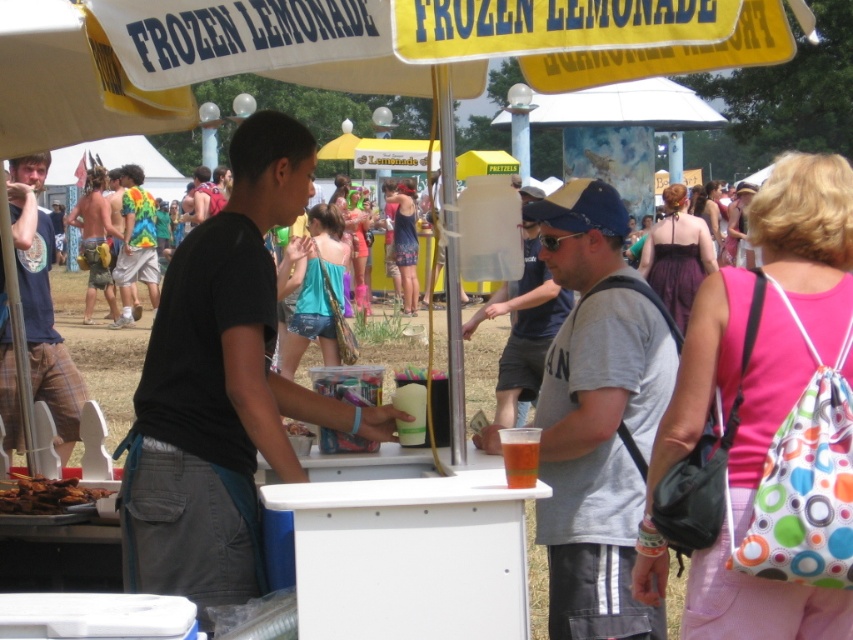
Is black fabric apron at center bigger than brushed metal t-shirt at left?

No.

Between point (138, 541) and point (38, 259), which one is positioned in front?

Point (138, 541) is in front.

Where is `black fabric apron at center`? black fabric apron at center is located at coordinates (222, 387).

Is tie-dye fabric shirt at left above golden crispy chicken at lower left?

Indeed, tie-dye fabric shirt at left is positioned over golden crispy chicken at lower left.

Between tie-dye fabric shirt at left and golden crispy chicken at lower left, which one has more height?

tie-dye fabric shirt at left

At what (x,y) coordinates should I click in order to perform the action: click on tie-dye fabric shirt at left. Please return your answer as a coordinate pair (x, y). This screenshot has height=640, width=853. Looking at the image, I should click on (135, 243).

You are a GUI agent. You are given a task and a screenshot of the screen. Output one action in this format:
    pyautogui.click(x=<x>, y=<y>)
    Task: Click on the tie-dye fabric shirt at left
    
    Given the screenshot: What is the action you would take?
    pyautogui.click(x=135, y=243)

Who is more forward, (22, 275) or (503, 449)?

Point (503, 449) is in front.

Between point (39, 378) and point (515, 467), which one is positioned behind?

The point (39, 378) is behind.

The image size is (853, 640). Describe the element at coordinates (42, 301) in the screenshot. I see `brushed metal t-shirt at left` at that location.

This screenshot has height=640, width=853. I want to click on brushed metal t-shirt at left, so click(x=42, y=301).